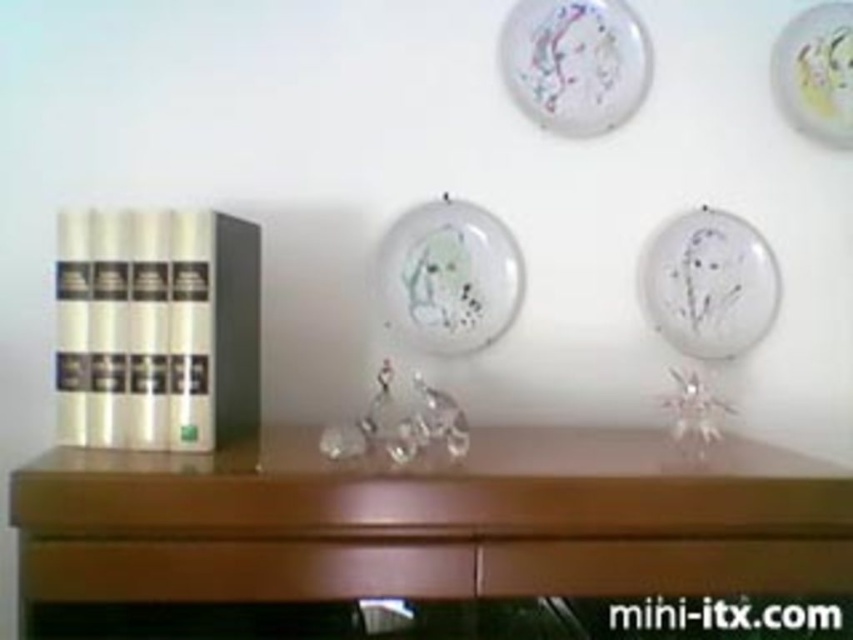
Question: Can you confirm if porcelain plate at upper center is positioned to the left of white glossy plate at upper right?

Choices:
 (A) no
 (B) yes

Answer: (B)

Question: Is the position of brown wood drawer at center more distant than that of porcelain plate at center?

Choices:
 (A) yes
 (B) no

Answer: (B)

Question: Which point is closer to the camera?

Choices:
 (A) (676, 292)
 (B) (456, 278)
 (C) (605, 582)
 (D) (814, 54)

Answer: (C)

Question: Based on their relative distances, which object is farther from the porcelain plate at center?

Choices:
 (A) white glossy plate at upper right
 (B) transparent glass plate at upper right

Answer: (A)

Question: Does porcelain plate at upper center appear over transparent glass plate at upper right?

Choices:
 (A) yes
 (B) no

Answer: (A)

Question: Among these points, which one is nearest to the camera?

Choices:
 (A) (608, 40)
 (B) (700, 214)
 (C) (401, 296)
 (D) (122, 573)

Answer: (D)